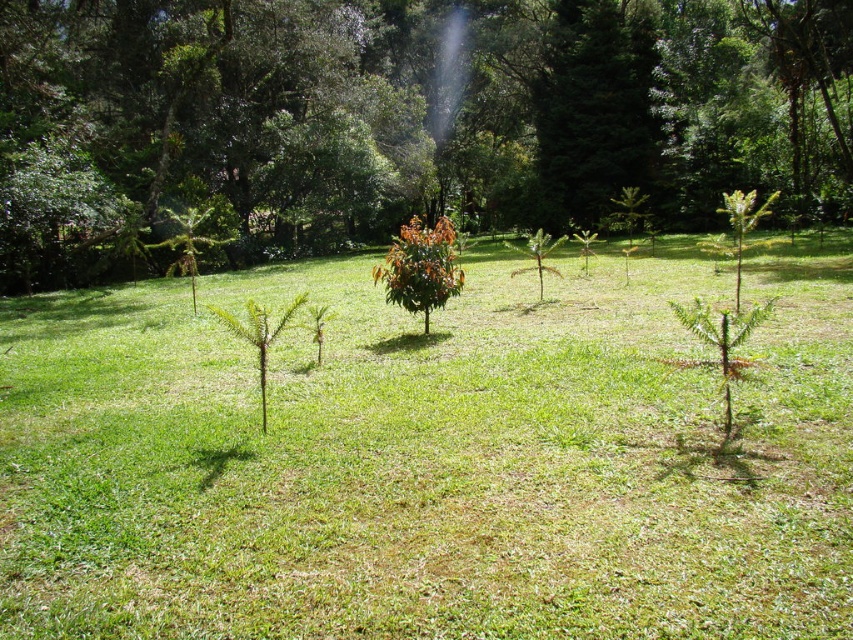
Does green grassy at center appear on the right side of green leafy tree at center?

In fact, green grassy at center is to the left of green leafy tree at center.

Is point (360, 412) positioned behind point (734, 148)?

That is False.

The width and height of the screenshot is (853, 640). I want to click on green grassy at center, so click(428, 458).